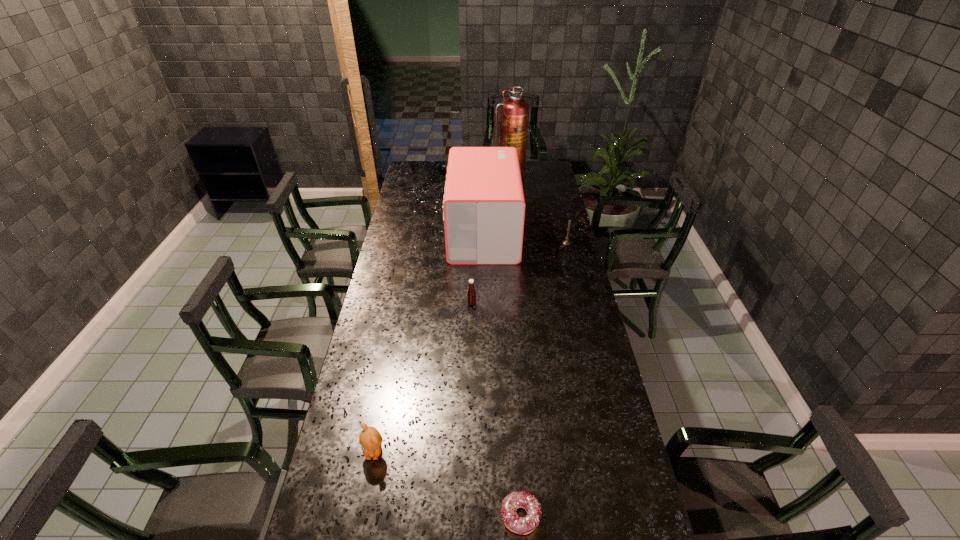
Locate an element on the screen. Image resolution: width=960 pixels, height=540 pixels. vacant space situated 0.180m on the surface of the box where the text is embossed is located at coordinates (410, 233).

Where is `vacant space located on the surface of the box where the text is embossed`? vacant space located on the surface of the box where the text is embossed is located at coordinates click(404, 233).

At what (x,y) coordinates should I click in order to perform the action: click on vacant space located on the surface of the box where the text is embossed. Please return your answer as a coordinate pair (x, y). The image size is (960, 540). Looking at the image, I should click on (390, 233).

Where is `vacant space located 0.110m on the back of the candle`? The width and height of the screenshot is (960, 540). vacant space located 0.110m on the back of the candle is located at coordinates (563, 227).

Find the location of a particular element. Image resolution: width=960 pixels, height=540 pixels. vacant space located 0.180m on the left of the fourth farthest object is located at coordinates (421, 303).

This screenshot has width=960, height=540. What are the coordinates of `free location located 0.090m on the face of the fifth farthest object` in the screenshot? It's located at (366, 495).

The image size is (960, 540). Find the location of `free space located 0.130m on the left of the nearest object`. free space located 0.130m on the left of the nearest object is located at coordinates (450, 516).

At what (x,y) coordinates should I click in order to perform the action: click on object situated at the far edge. Please return your answer as a coordinate pair (x, y). Looking at the image, I should click on (514, 117).

Identify the location of object that is at the left edge. (x=370, y=439).

The width and height of the screenshot is (960, 540). I want to click on object at the right edge, so click(566, 242).